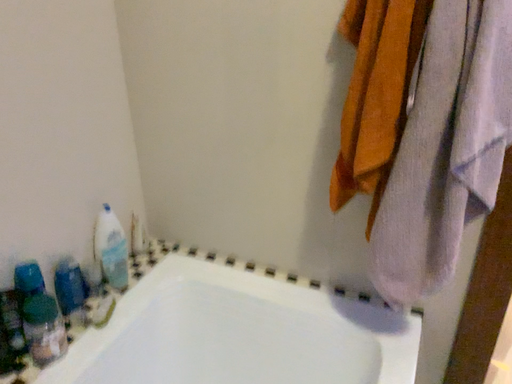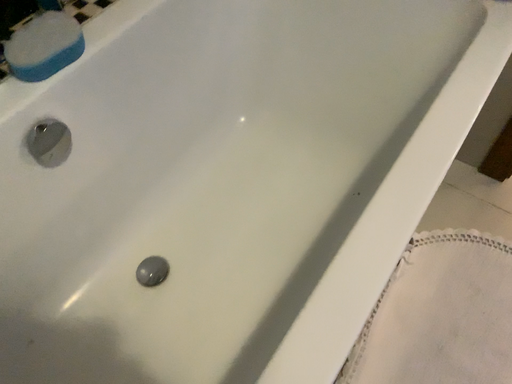
Question: Which way did the camera rotate in the video?

Choices:
 (A) rotated right
 (B) rotated left

Answer: (B)